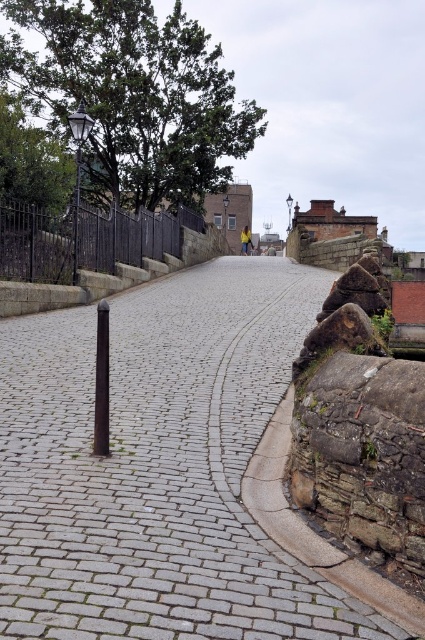
You are a delivery person standing on the gray cobblestone pavement at center and need to reach the black polished pole at center. Which direction should you move to get there?

The gray cobblestone pavement at center is to the right of the black polished pole at center, so you should move to the left to reach it.

You are a delivery person trying to navigate a narrow cobblestone street. You need to determine if your delivery cart, which is 1.2 meters tall, can pass under the gray cobblestone pavement at center and the green leafy tree at upper left. Which object might pose a height restriction for your cart?

The gray cobblestone pavement at center has a lesser height compared to the green leafy tree at upper left. Therefore, the green leafy tree at upper left is taller and may pose a height restriction for the delivery cart.

You are a city planner examining the cobblestone street. You notice the gray cobblestone pavement at center and the black polished pole at center. Which object is located directly above the other?

The gray cobblestone pavement at center is positioned over the black polished pole at center, meaning the pavement is directly above the pole.